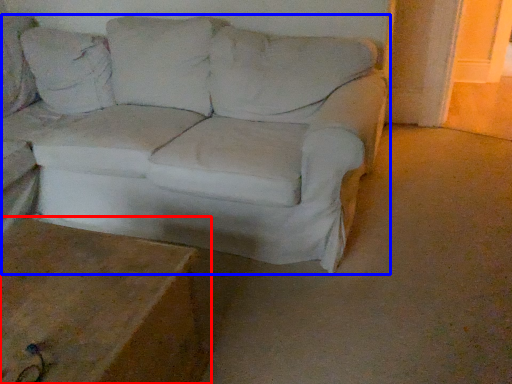
Question: Which of the following is the closest to the observer, table (highlighted by a red box) or studio couch (highlighted by a blue box)?

Choices:
 (A) table
 (B) studio couch

Answer: (A)